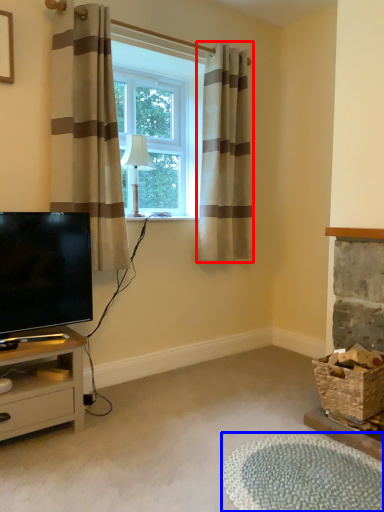
Question: Which point is further to the camera, curtain (highlighted by a red box) or plain (highlighted by a blue box)?

Choices:
 (A) curtain
 (B) plain

Answer: (A)